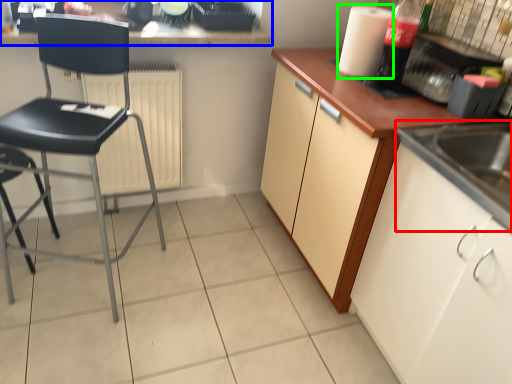
Question: Estimate the real-world distances between objects in this image. Which object is farther from sink (highlighted by a red box), countertop (highlighted by a blue box) or paper towel (highlighted by a green box)?

Choices:
 (A) countertop
 (B) paper towel

Answer: (A)